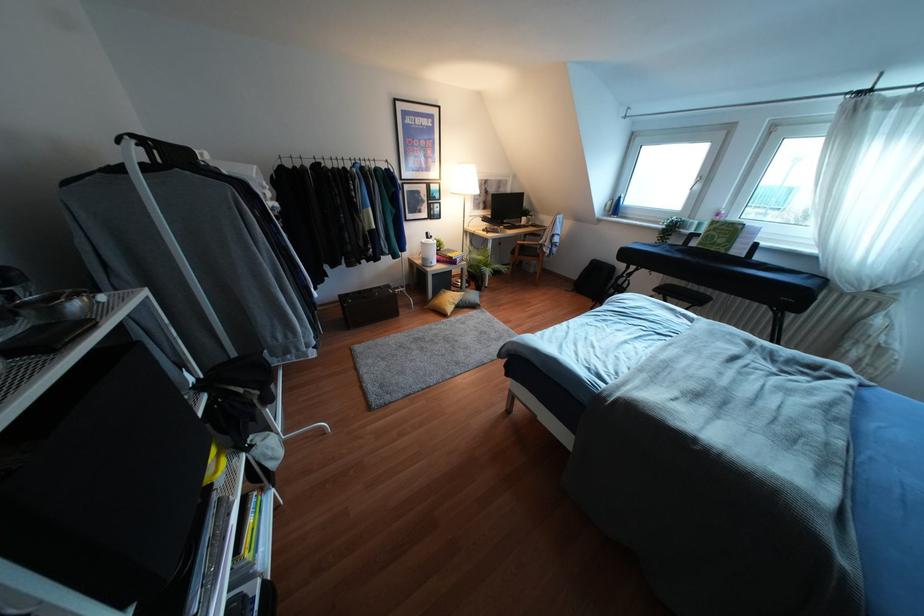
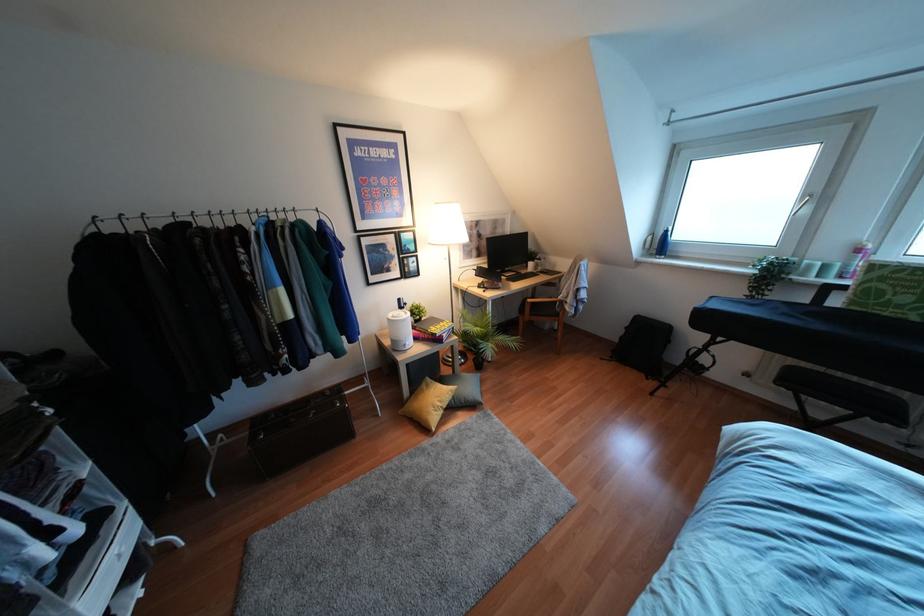
Locate, in the second image, the point that corresponds to (690,223) in the first image.

(809, 265)